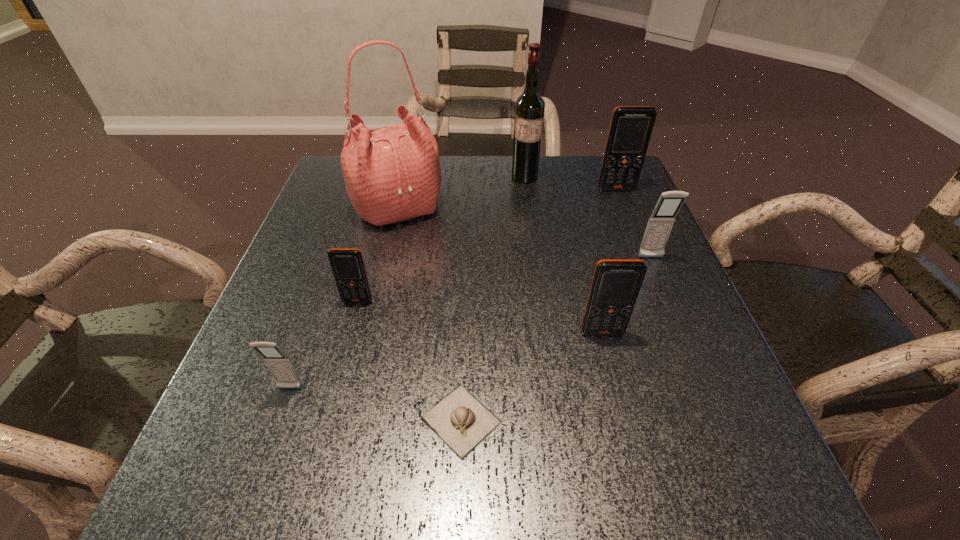
Locate an element on the screen. This screenshot has width=960, height=540. handbag is located at coordinates (392, 174).

Locate an element on the screen. The height and width of the screenshot is (540, 960). wine bottle is located at coordinates (529, 108).

What are the coordinates of `the farthest object` in the screenshot? It's located at (529, 108).

Identify the location of the tallest cellular telephone. This screenshot has width=960, height=540. (630, 130).

The image size is (960, 540). I want to click on the farthest orange cellular telephone, so click(630, 130).

Where is `the right gray cellular telephone`? the right gray cellular telephone is located at coordinates (661, 221).

Find the location of a particular element. The width and height of the screenshot is (960, 540). the fifth nearest object is located at coordinates (661, 221).

The height and width of the screenshot is (540, 960). Find the location of `the sixth farthest object`. the sixth farthest object is located at coordinates (616, 283).

What are the coordinates of `the nearest orange cellular telephone` in the screenshot? It's located at (616, 283).

The width and height of the screenshot is (960, 540). Find the location of `the leftmost orange cellular telephone`. the leftmost orange cellular telephone is located at coordinates (347, 265).